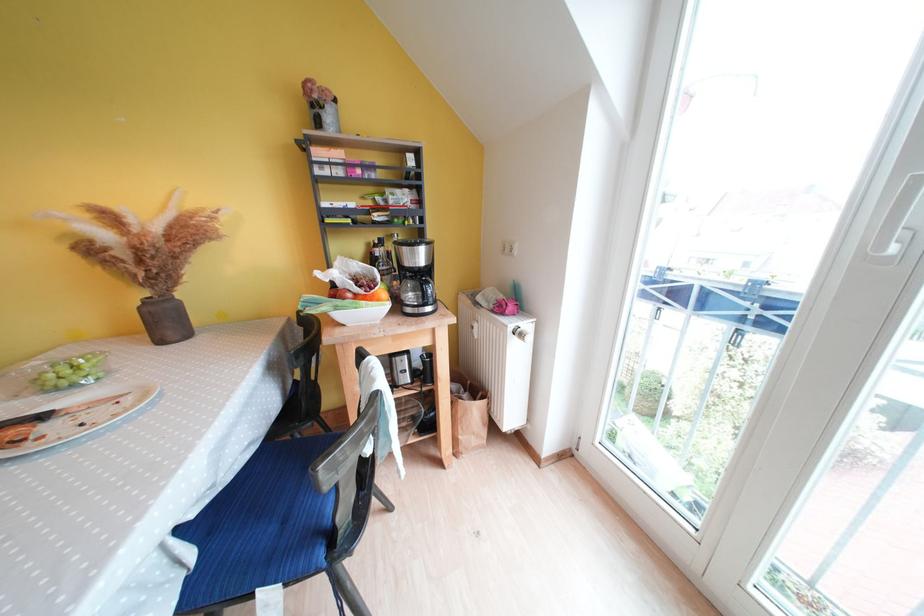
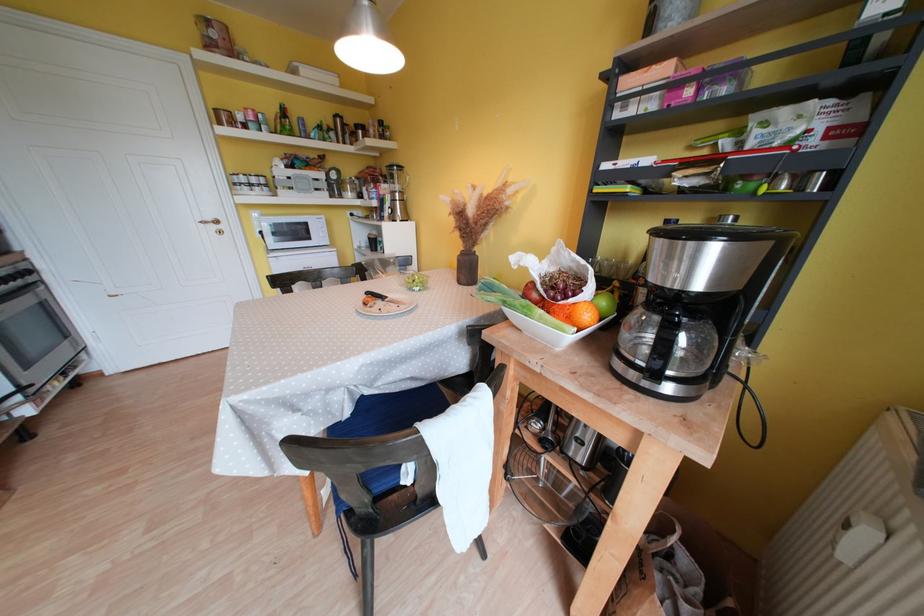
Locate, in the second image, the point that corresponds to (382,292) in the first image.

(578, 302)